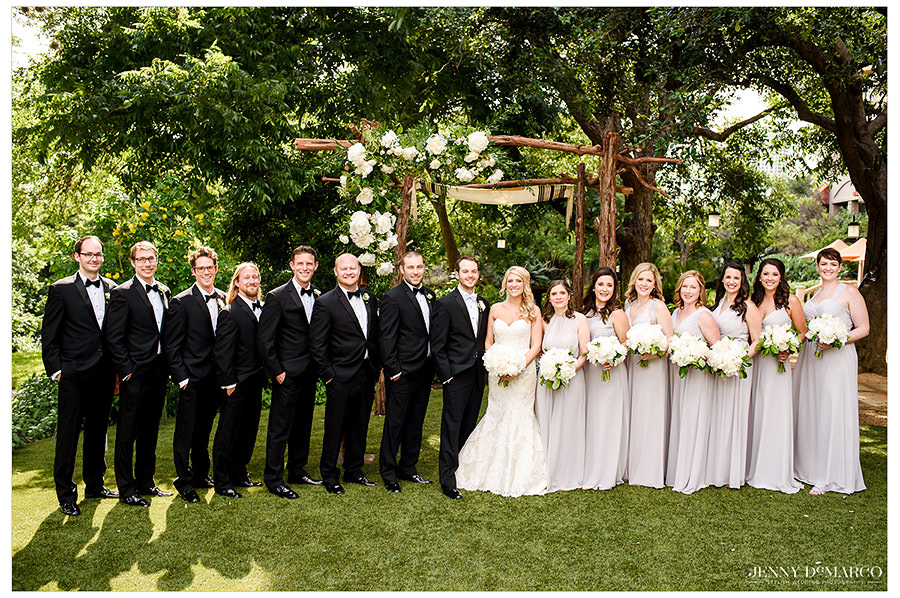
Where is `bouquets of flowers`? bouquets of flowers is located at coordinates (830, 334), (778, 343), (732, 361), (690, 353), (646, 338), (608, 358), (563, 365), (509, 360).